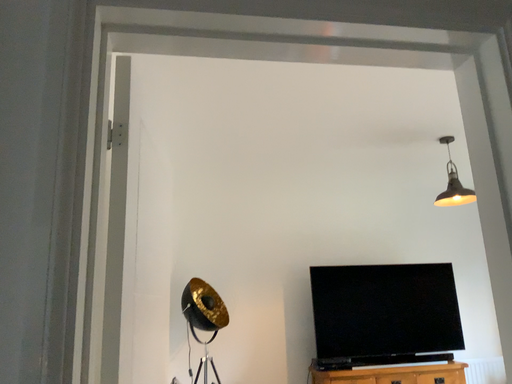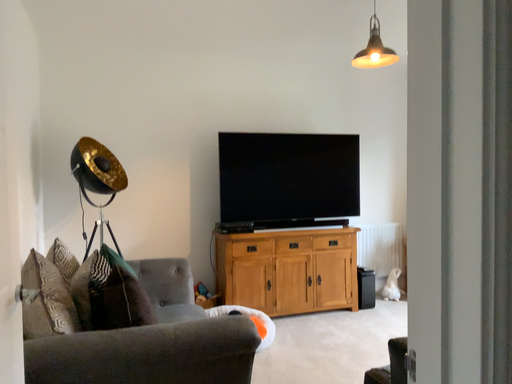
Question: How did the camera likely rotate when shooting the video?

Choices:
 (A) rotated left
 (B) rotated right

Answer: (B)